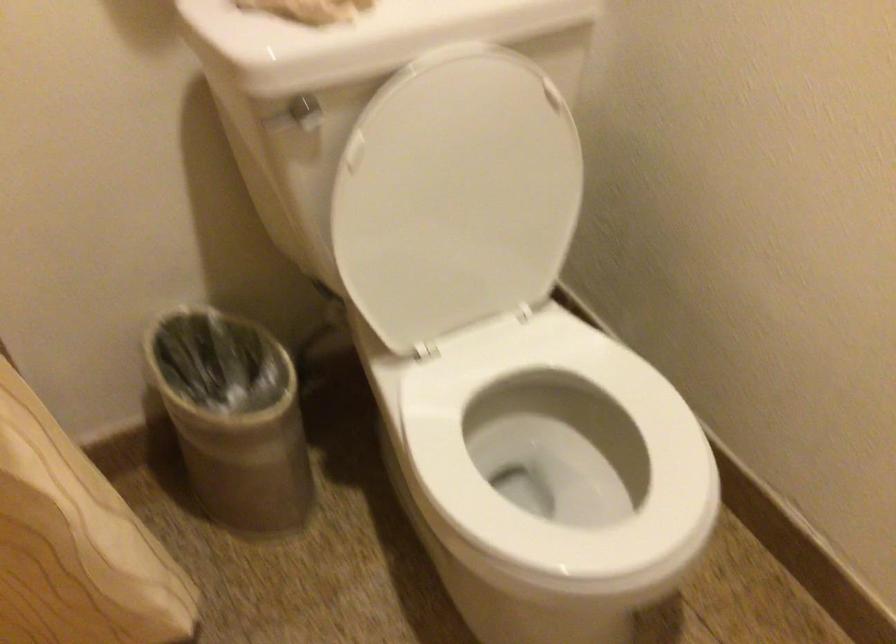
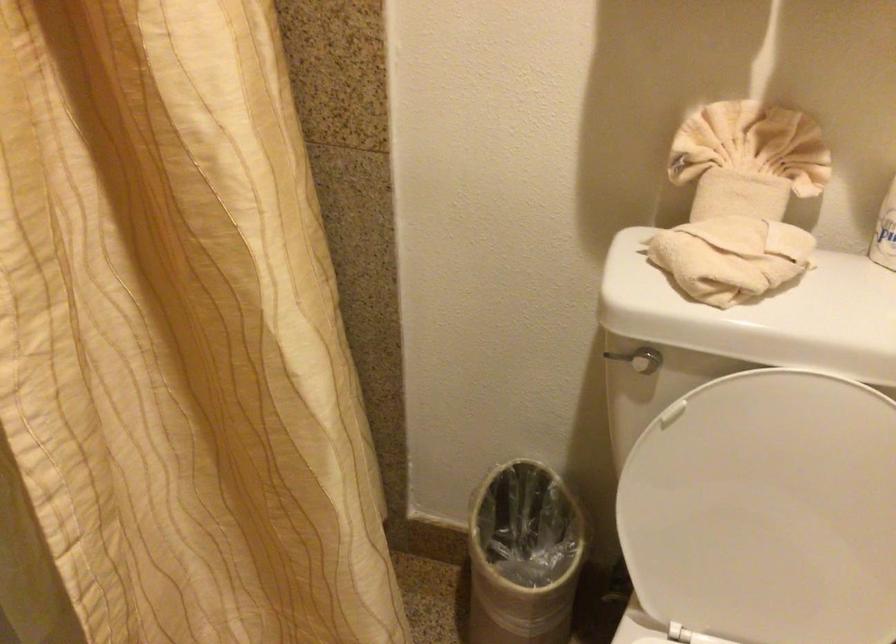
Where in the second image is the point corresponding to (x=453, y=205) from the first image?

(767, 511)